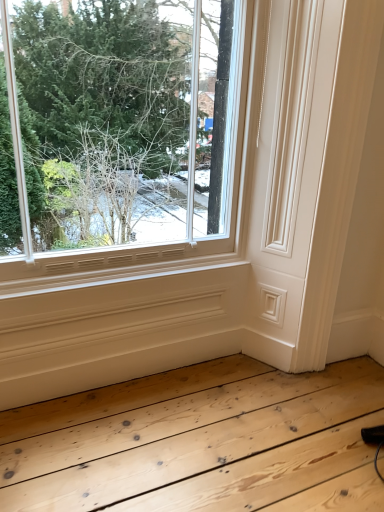
This screenshot has height=512, width=384. What do you see at coordinates (122, 134) in the screenshot?
I see `clear glass window at upper left` at bounding box center [122, 134].

Where is `clear glass window at upper left`? clear glass window at upper left is located at coordinates (122, 134).

Locate an element on the screen. The width and height of the screenshot is (384, 512). clear glass window at upper left is located at coordinates (122, 134).